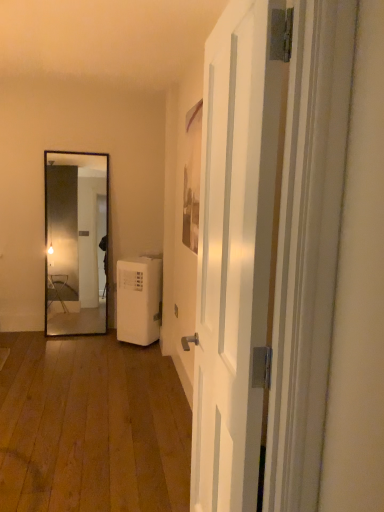
This screenshot has height=512, width=384. What do you see at coordinates (237, 250) in the screenshot? I see `white glossy door at center` at bounding box center [237, 250].

Where is `white glossy door at center`? This screenshot has height=512, width=384. white glossy door at center is located at coordinates click(x=237, y=250).

Describe the element at coordinates (139, 298) in the screenshot. I see `white plastic water heater at lower center` at that location.

Where is `white plastic water heater at lower center`? The height and width of the screenshot is (512, 384). white plastic water heater at lower center is located at coordinates (139, 298).

Where is `white glossy door at center`? white glossy door at center is located at coordinates (237, 250).

Which is more to the left, white glossy door at center or white plastic water heater at lower center?

From the viewer's perspective, white plastic water heater at lower center appears more on the left side.

Considering the positions of objects white glossy door at center and white plastic water heater at lower center in the image provided, who is behind, white glossy door at center or white plastic water heater at lower center?

white plastic water heater at lower center is further away from the camera.

Is point (285, 16) more distant than point (147, 310)?

No, (285, 16) is closer to viewer.

In the scene shown: From the image's perspective, is white glossy door at center located beneath white plastic water heater at lower center?

No.

From a real-world perspective, is white glossy door at center on white plastic water heater at lower center?

Correct, in the physical world, white glossy door at center is higher than white plastic water heater at lower center.

In terms of width, does white glossy door at center look wider or thinner when compared to white plastic water heater at lower center?

Clearly, white glossy door at center has less width compared to white plastic water heater at lower center.

Who is taller, white glossy door at center or white plastic water heater at lower center?

white glossy door at center.

Considering the relative sizes of white glossy door at center and white plastic water heater at lower center in the image provided, is white glossy door at center bigger than white plastic water heater at lower center?

Yes.

Is white glossy door at center inside the boundaries of white plastic water heater at lower center, or outside?

white glossy door at center is spatially situated outside white plastic water heater at lower center.

Is white glossy door at center placed right next to white plastic water heater at lower center?

white glossy door at center and white plastic water heater at lower center are not in contact.

Could you tell me if white glossy door at center is turned towards white plastic water heater at lower center?

No, white glossy door at center is not turned towards white plastic water heater at lower center.

The image size is (384, 512). What are the coordinates of `water heater that is behind the white glossy door at center` in the screenshot? It's located at (139, 298).

Considering the positions of objects white plastic water heater at lower center and white glossy door at center in the image provided, who is more to the left, white plastic water heater at lower center or white glossy door at center?

white plastic water heater at lower center.

From the picture: Relative to white glossy door at center, is white plastic water heater at lower center in front or behind?

white plastic water heater at lower center is positioned farther from the viewer than white glossy door at center.

Does point (118, 317) come in front of point (233, 424)?

No.

From the image's perspective, is white plastic water heater at lower center beneath white glossy door at center?

Yes, from the image's perspective, white plastic water heater at lower center is below white glossy door at center.

Consider the image. From a real-world perspective, relative to white glossy door at center, is white plastic water heater at lower center vertically above or below?

white plastic water heater at lower center is below white glossy door at center.

Can you confirm if white plastic water heater at lower center is thinner than white glossy door at center?

Incorrect, the width of white plastic water heater at lower center is not less than that of white glossy door at center.

From their relative heights in the image, would you say white plastic water heater at lower center is taller or shorter than white glossy door at center?

Considering their sizes, white plastic water heater at lower center has less height than white glossy door at center.

Considering the sizes of objects white plastic water heater at lower center and white glossy door at center in the image provided, who is smaller, white plastic water heater at lower center or white glossy door at center?

white plastic water heater at lower center.

Is white plastic water heater at lower center positioned beyond the bounds of white glossy door at center?

Yes, white plastic water heater at lower center is located beyond the bounds of white glossy door at center.

Is white plastic water heater at lower center positioned far away from white glossy door at center?

That's right, there is a large distance between white plastic water heater at lower center and white glossy door at center.

Looking at this image, is white plastic water heater at lower center oriented towards white glossy door at center?

No.

The height and width of the screenshot is (512, 384). Find the location of `door above the white plastic water heater at lower center (from a real-world perspective)`. door above the white plastic water heater at lower center (from a real-world perspective) is located at coordinates (237, 250).

The width and height of the screenshot is (384, 512). What are the coordinates of `door on the right side of white plastic water heater at lower center` in the screenshot? It's located at (237, 250).

The image size is (384, 512). I want to click on door in front of the white plastic water heater at lower center, so click(237, 250).